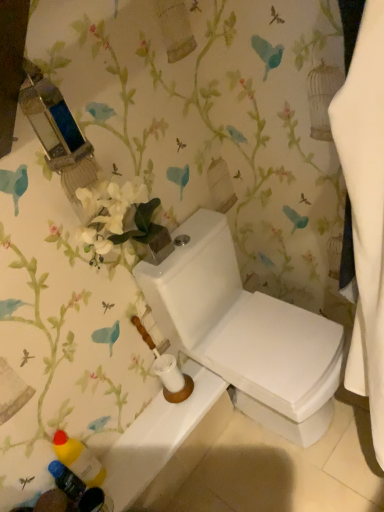
Locate an element on the screen. The width and height of the screenshot is (384, 512). free point to the right of blue plastic bottle at lower left, which ranks as the 1th toiletry in bottom-to-top order is located at coordinates (135, 464).